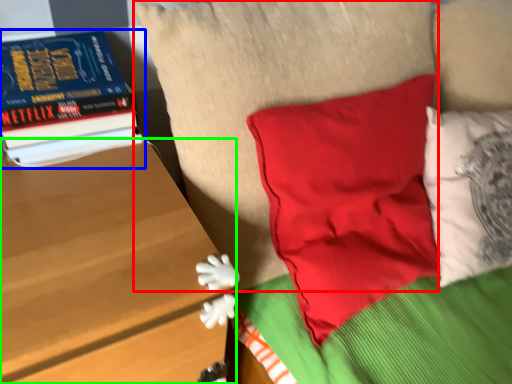
Question: Which is nearer to the pillow (highlighted by a red box)? book (highlighted by a blue box) or table (highlighted by a green box).

Choices:
 (A) book
 (B) table

Answer: (A)